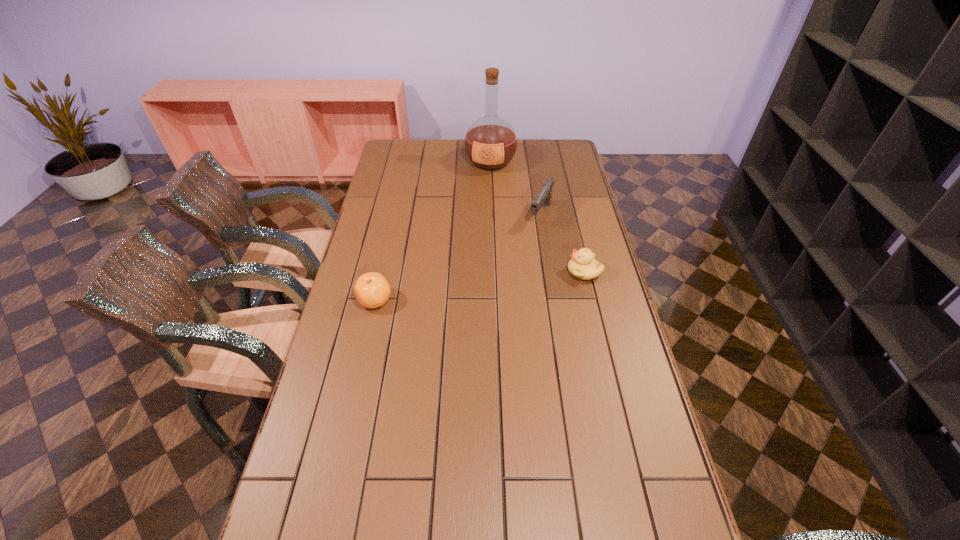
The width and height of the screenshot is (960, 540). I want to click on unoccupied position between the clementine and the duckling, so tap(480, 286).

Identify the location of free spot between the third nearest object and the second object from left to right. The height and width of the screenshot is (540, 960). (516, 188).

The height and width of the screenshot is (540, 960). What are the coordinates of `vacant space that is in between the gun and the rightmost object` in the screenshot? It's located at (563, 243).

The image size is (960, 540). In order to click on free point between the third object from left to right and the third farthest object in this screenshot , I will do `click(563, 243)`.

Find the location of `vacant area that lies between the nearest object and the third nearest object`. vacant area that lies between the nearest object and the third nearest object is located at coordinates (458, 257).

You are a GUI agent. You are given a task and a screenshot of the screen. Output one action in this format:
    pyautogui.click(x=<x>, y=<y>)
    Task: Click on the vacant point located between the clementine and the second nearest object
    The height and width of the screenshot is (540, 960).
    Given the screenshot: What is the action you would take?
    pyautogui.click(x=480, y=286)

Locate which object ranks in proximity to the gun. Please provide its 2D coordinates. Your answer should be formatted as a tuple, i.e. [(x, y)], where the tuple contains the x and y coordinates of a point satisfying the conditions above.

[(583, 266)]

Select which object is the third closest to the second farthest object. Please provide its 2D coordinates. Your answer should be formatted as a tuple, i.e. [(x, y)], where the tuple contains the x and y coordinates of a point satisfying the conditions above.

[(372, 290)]

This screenshot has width=960, height=540. I want to click on vacant space that satisfies the following two spatial constraints: 1. on the front side of the third farthest object; 2. on the beak of the liquor, so click(x=494, y=272).

At what (x,y) coordinates should I click in order to perform the action: click on free space that satisfies the following two spatial constraints: 1. on the front side of the third nearest object; 2. on the beak of the third farthest object. Please return your answer as a coordinate pair (x, y). Looking at the image, I should click on (550, 272).